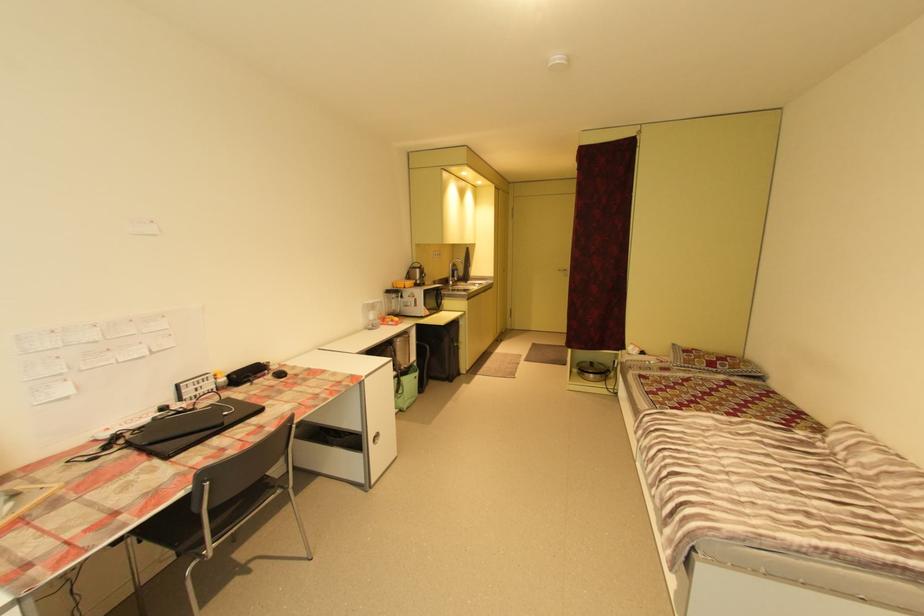
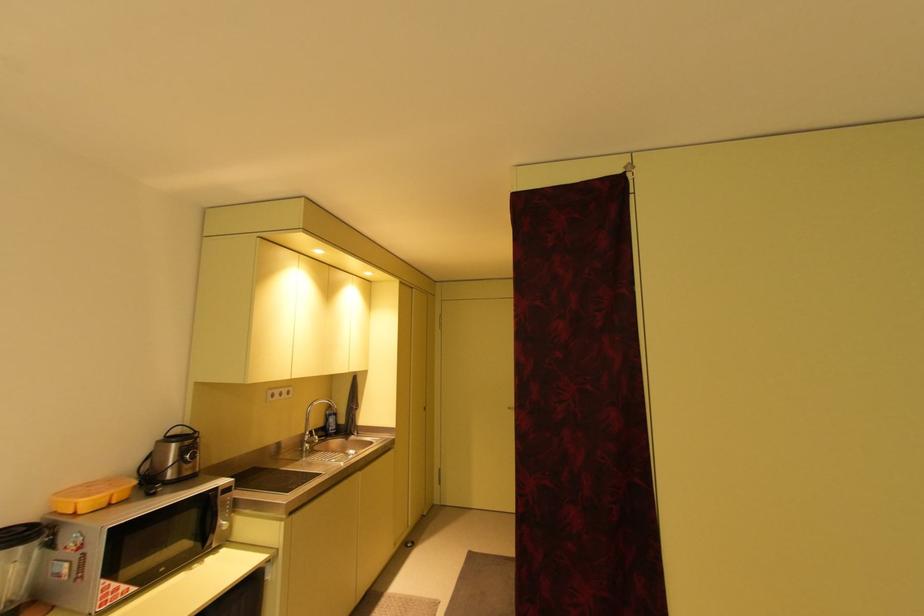
What movement of the cameraman would produce the second image?

The movement direction of the cameraman is right, forward.